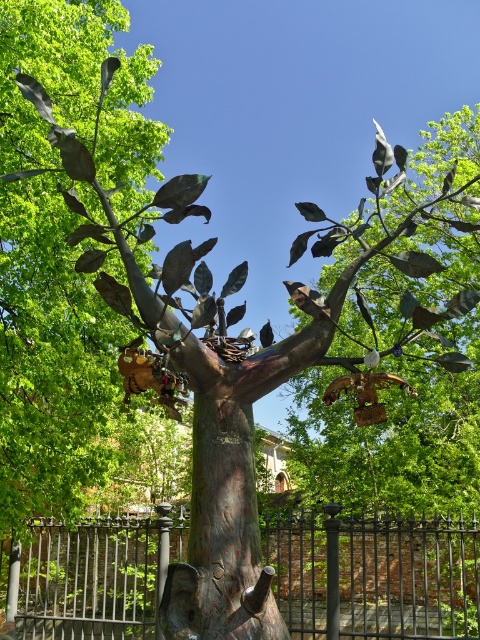
You are standing in front of the tree with padlocks and want to take a photo of the black wrought iron fence at lower center. Where should you look to find it?

The black wrought iron fence at lower center is located at point [374,576].

Consider the image. You are standing in a park and see the black wrought iron fence at lower center and the rustic wood tree trunk at center. Which object is located to the right of the other?

The black wrought iron fence at lower center is positioned on the right side of rustic wood tree trunk at center, so the black wrought iron fence at lower center is to the right of the rustic wood tree trunk at center.